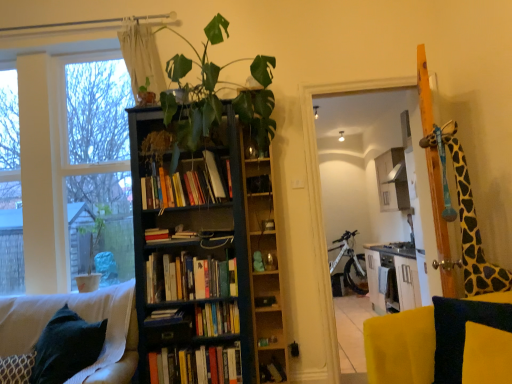
Question: From the image's perspective, is white glossy cabinet at upper center over white matte bicycle at center?

Choices:
 (A) no
 (B) yes

Answer: (B)

Question: Can you confirm if white glossy cabinet at upper center is taller than white matte bicycle at center?

Choices:
 (A) no
 (B) yes

Answer: (A)

Question: Can you confirm if white glossy cabinet at upper center is shorter than white matte bicycle at center?

Choices:
 (A) yes
 (B) no

Answer: (A)

Question: Does white glossy cabinet at upper center lie in front of white matte bicycle at center?

Choices:
 (A) no
 (B) yes

Answer: (B)

Question: Is white glossy cabinet at upper center wider than white matte bicycle at center?

Choices:
 (A) yes
 (B) no

Answer: (B)

Question: From the image's perspective, is white glossy cabinet at upper center below white matte bicycle at center?

Choices:
 (A) no
 (B) yes

Answer: (A)

Question: Does wooden bookshelf at center have a greater height compared to white sheer curtain at upper left?

Choices:
 (A) yes
 (B) no

Answer: (A)

Question: Could you tell me if wooden bookshelf at center is facing white sheer curtain at upper left?

Choices:
 (A) no
 (B) yes

Answer: (A)

Question: Can you confirm if wooden bookshelf at center is wider than white sheer curtain at upper left?

Choices:
 (A) no
 (B) yes

Answer: (B)

Question: From the image's perspective, is wooden bookshelf at center on top of white sheer curtain at upper left?

Choices:
 (A) yes
 (B) no

Answer: (B)

Question: Is wooden bookshelf at center touching white sheer curtain at upper left?

Choices:
 (A) yes
 (B) no

Answer: (B)

Question: Can you confirm if wooden bookshelf at center is smaller than white sheer curtain at upper left?

Choices:
 (A) yes
 (B) no

Answer: (B)

Question: Considering the relative sizes of yellow fabric pillow at lower right and dark blue wood bookcase at center in the image provided, is yellow fabric pillow at lower right taller than dark blue wood bookcase at center?

Choices:
 (A) yes
 (B) no

Answer: (B)